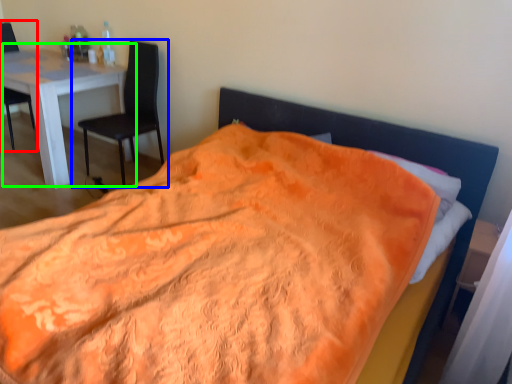
Question: Based on their relative distances, which object is nearer to chair (highlighted by a red box)? Choose from chair (highlighted by a blue box) and table (highlighted by a green box).

Choices:
 (A) chair
 (B) table

Answer: (B)